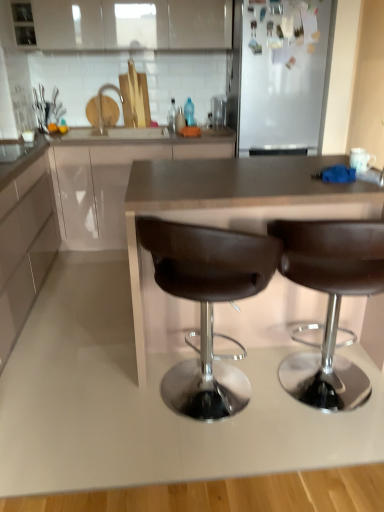
Identify the location of free space above brown leather stool at center, the first chair when ordered from left to right (from a real-world perspective). This screenshot has height=512, width=384. (206, 199).